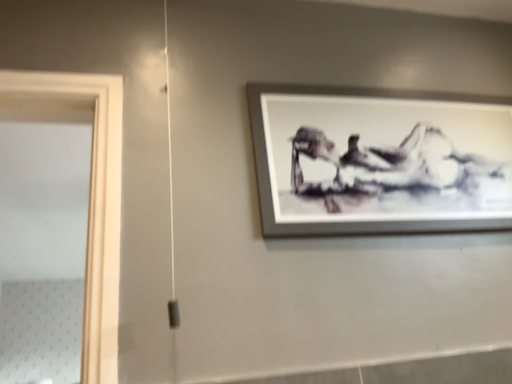
You are a GUI agent. You are given a task and a screenshot of the screen. Output one action in this format:
    pyautogui.click(x=<x>, y=<y>)
    Task: Click on the silver metallic picture frame at upper right
    
    Given the screenshot: What is the action you would take?
    pyautogui.click(x=380, y=160)

Image resolution: width=512 pixels, height=384 pixels. Describe the element at coordinates (380, 160) in the screenshot. I see `silver metallic picture frame at upper right` at that location.

At what (x,y) coordinates should I click in order to perform the action: click on silver metallic picture frame at upper right. Please return your answer as a coordinate pair (x, y). The height and width of the screenshot is (384, 512). Looking at the image, I should click on (380, 160).